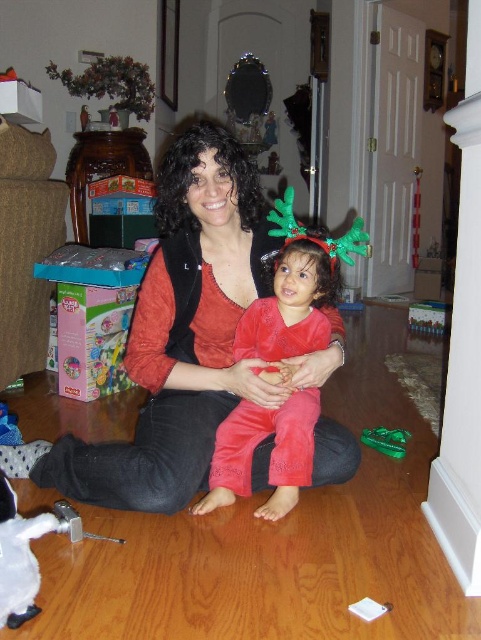
You are a photographer setting up for a family photo. You see the matte black vest at center and the green plastic toy at lower right in the scene. Which object is positioned higher from the ground?

The matte black vest at center is located above the green plastic toy at lower right, so it is positioned higher from the ground.

You are a photographer setting up for a family photo. You need to place a small decoration between the matte black vest at center and the green plastic toy at lower right so it appears centered in the photo. Considering their positions, where should you place the decoration?

The matte black vest at center is closer to the viewer than the green plastic toy at lower right. To center the decoration between them, place it closer to the green plastic toy at lower right since it is farther away, balancing their distances in the photo.

You are a guest at this festive gathering and need to retrieve the green plastic toy at lower right. Can you easily access it without moving the velvet red pants at center?

The velvet red pants at center is positioned over the green plastic toy at lower right, so you cannot easily access the green plastic toy at lower right without moving the velvet red pants at center.